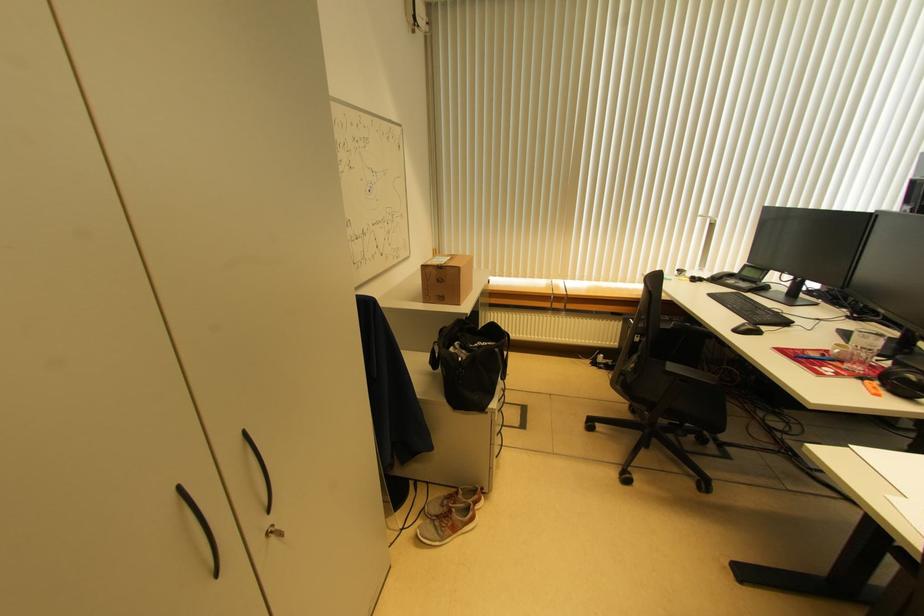
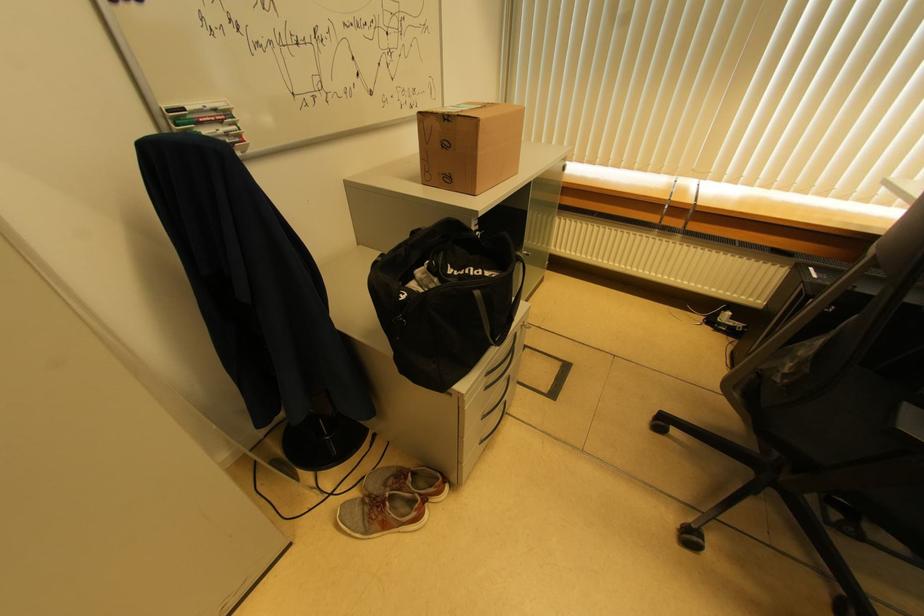
Find the pixel in the second image that matches (500,438) in the first image.

(485, 419)